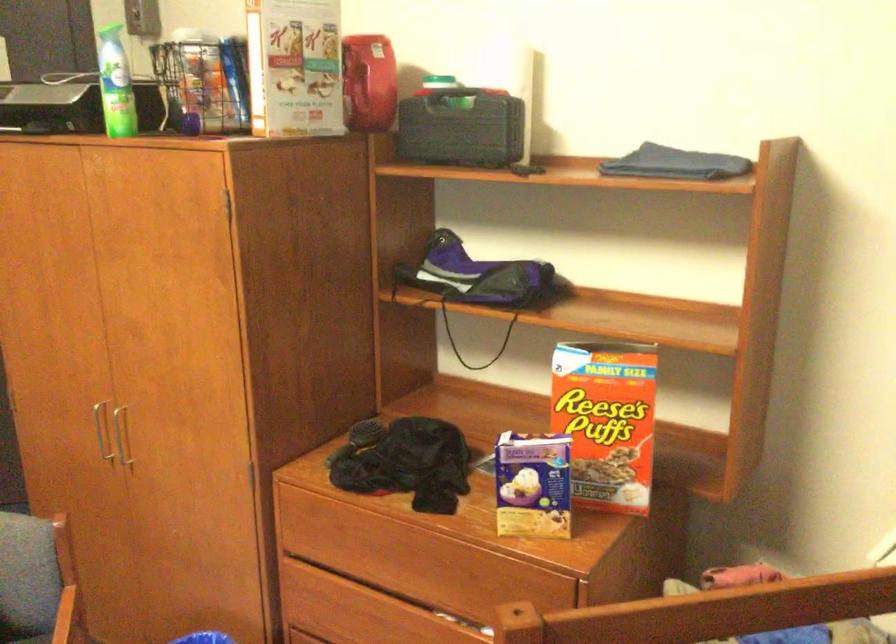
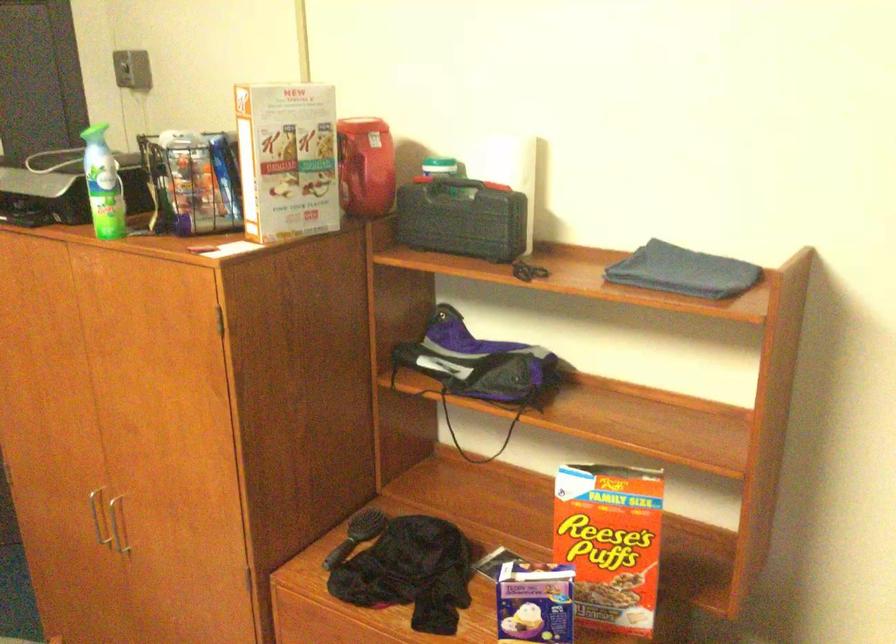
Question: Which direction would the cameraman need to move to produce the second image? Reply with the corresponding letter.

Choices:
 (A) Left
 (B) Right
 (C) Forward
 (D) Backward

Answer: (C)